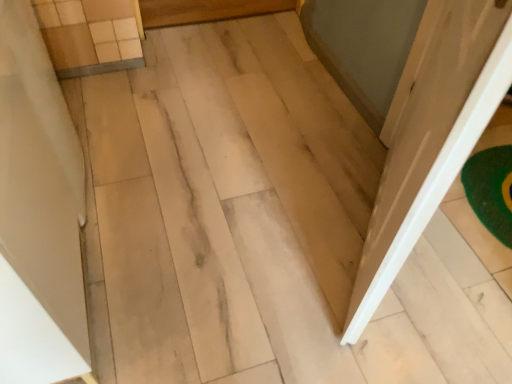
In order to click on vacant area on the back side of white wood door at right in this screenshot , I will do `click(310, 143)`.